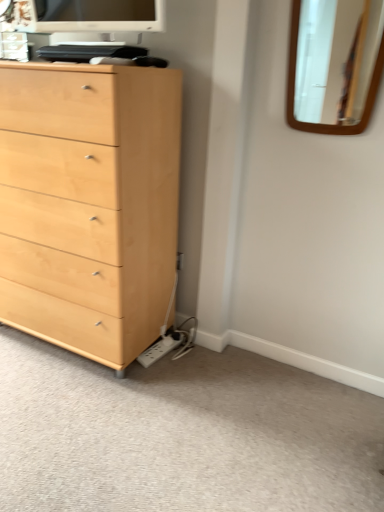
Question: Considering the positions of light wood chest of drawers at left and matte white monitor at upper center in the image, is light wood chest of drawers at left bigger or smaller than matte white monitor at upper center?

Choices:
 (A) small
 (B) big

Answer: (B)

Question: Is point (100, 143) closer or farther from the camera than point (72, 12)?

Choices:
 (A) closer
 (B) farther

Answer: (A)

Question: Estimate the real-world distances between objects in this image. Which object is closer to the light brown wood dresser at lower left?

Choices:
 (A) wooden mirror at upper right
 (B) matte white monitor at upper center
 (C) light wood chest of drawers at left

Answer: (C)

Question: Which is farther from the wooden mirror at upper right?

Choices:
 (A) matte white monitor at upper center
 (B) light wood chest of drawers at left
 (C) light brown wood dresser at lower left

Answer: (C)